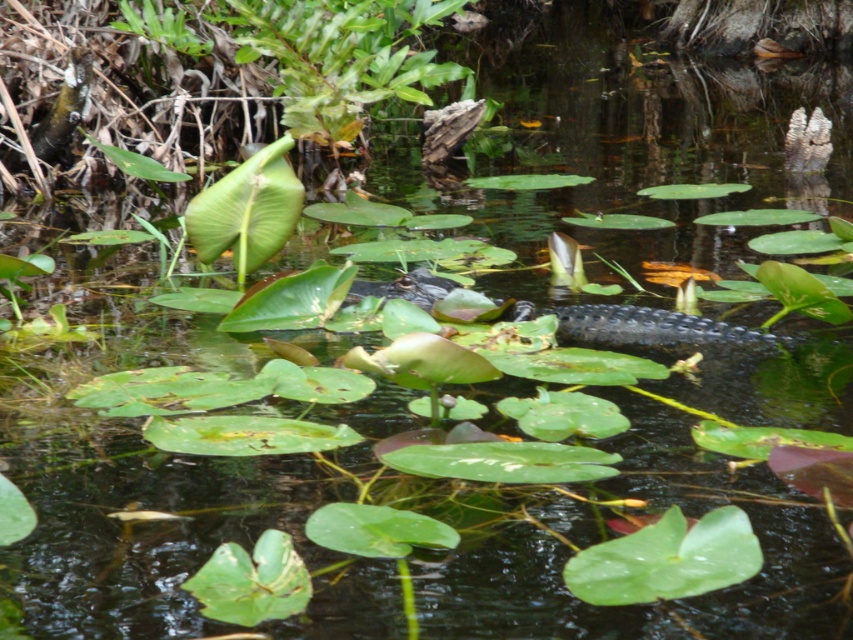
Question: Is green leafy plant at upper left smaller than dark green scaly crocodile at center?

Choices:
 (A) no
 (B) yes

Answer: (A)

Question: Can you confirm if green leafy plant at upper left is wider than dark green scaly crocodile at center?

Choices:
 (A) no
 (B) yes

Answer: (B)

Question: Among these objects, which one is farthest from the camera?

Choices:
 (A) green leafy plant at upper left
 (B) dark green scaly crocodile at center

Answer: (A)

Question: Which object appears farthest from the camera in this image?

Choices:
 (A) dark green scaly crocodile at center
 (B) green leafy plant at upper left

Answer: (B)

Question: Does green leafy plant at upper left have a smaller size compared to dark green scaly crocodile at center?

Choices:
 (A) yes
 (B) no

Answer: (B)